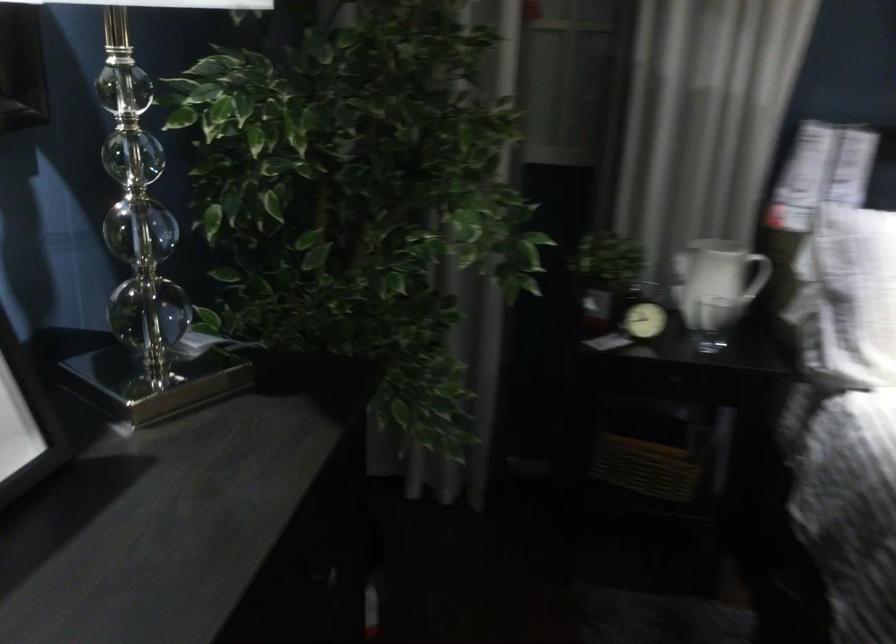
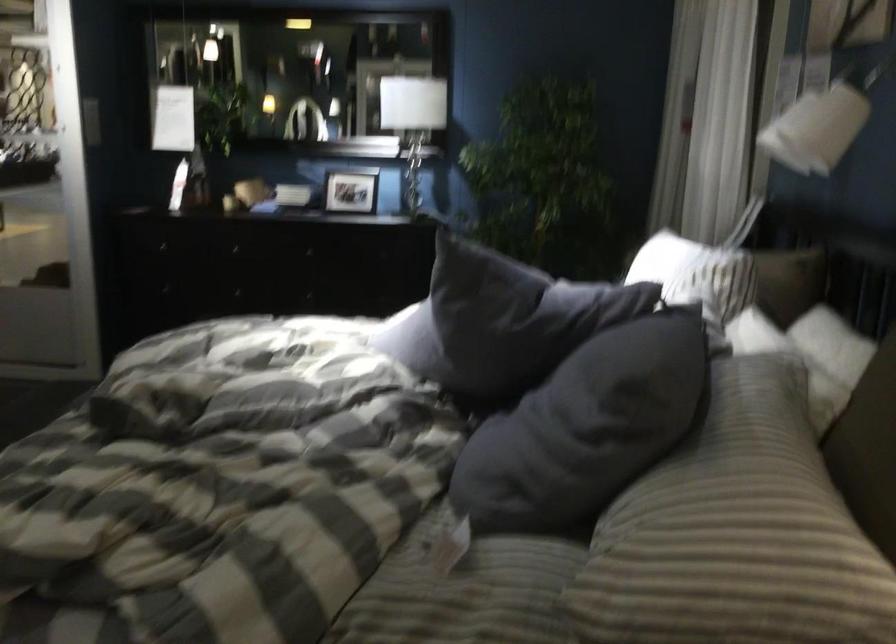
Question: I am providing you with two images of the same scene from different viewpoints. Which of the following objects are not visible in image2?

Choices:
 (A) stack of books
 (B) white pitcher handle
 (C) dark grey pillow
 (D) green toilet paper roll

Answer: (B)